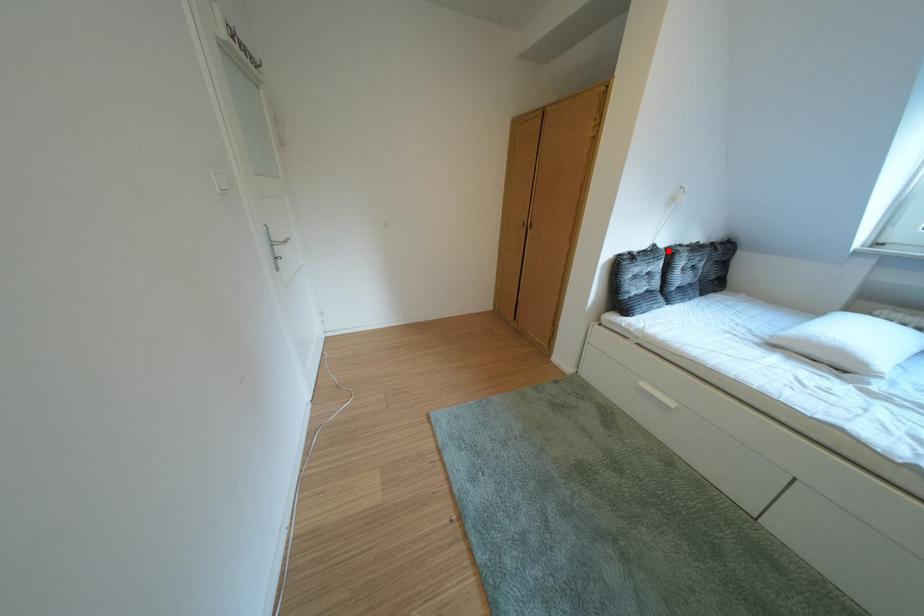
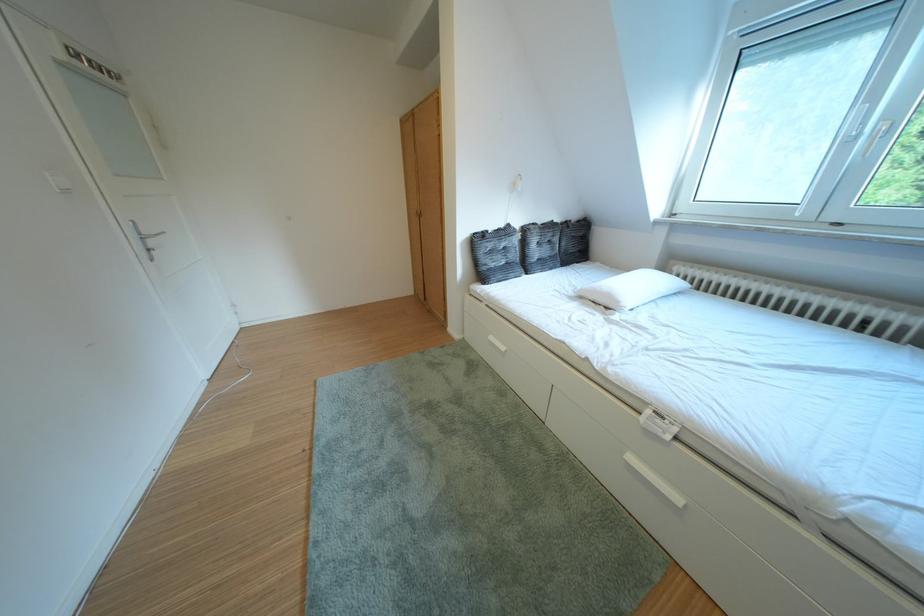
In the second image, find the point that corresponds to the highlighted location in the first image.

(523, 230)